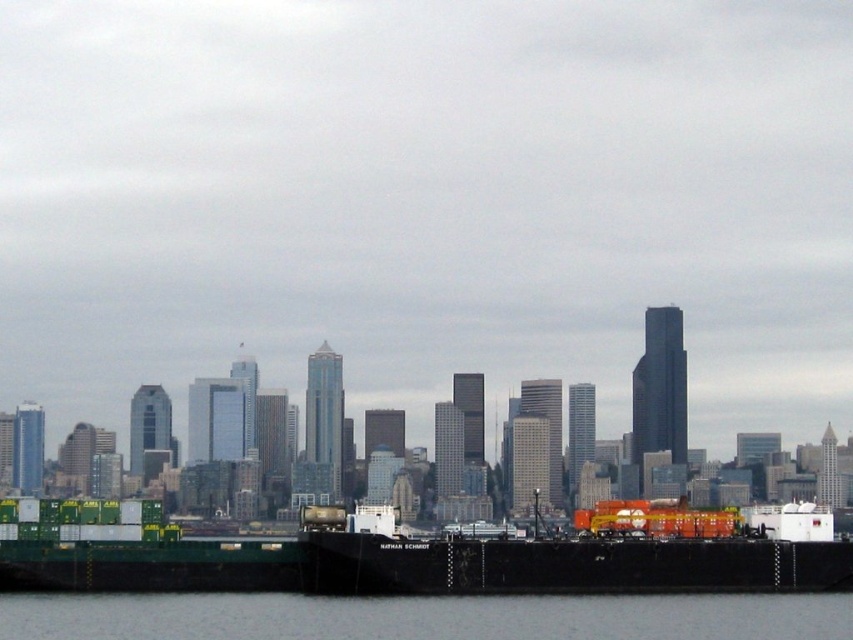
You are a crane operator tasked with moving a container from the black matte barge at lower center to a truck waiting on the shore. The container is 50 feet long. Can you safely lift the container without it touching the gray water at lower center?

The black matte barge at lower center is 49.92 feet away from the gray water at lower center. Since the container is 50 feet long, lifting it would cause it to extend beyond the 49.92 feet gap, resulting in contact with the water. Therefore, the container cannot be safely lifted without touching the gray water at lower center.

You are standing on the shore looking at the city skyline. There is a point marked at coordinates (567,556). What object is located at this point?

The point (567,556) corresponds to the black matte barge at lower center.